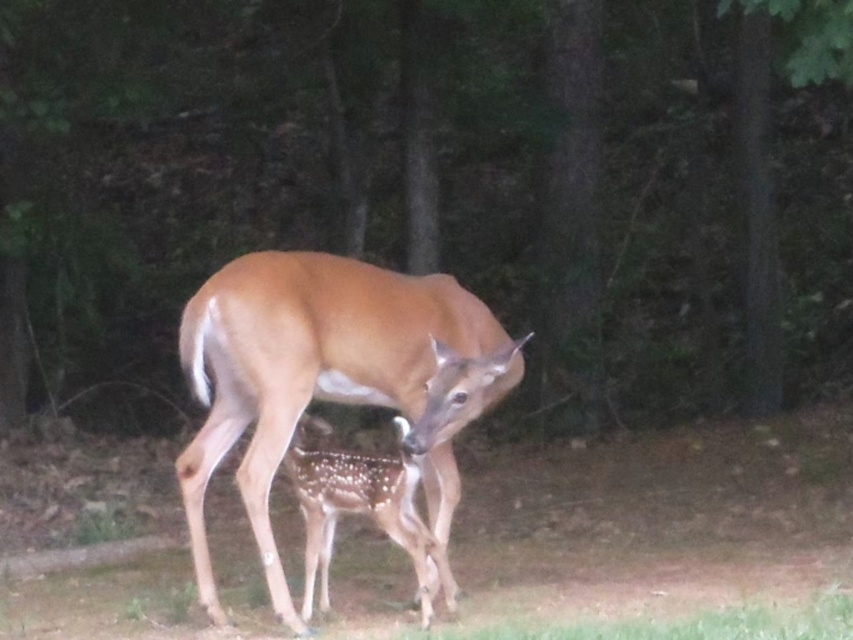
From the picture: Does brown velvet deer at center have a greater height compared to spotted fur fawn at center?

Correct, brown velvet deer at center is much taller as spotted fur fawn at center.

Does brown velvet deer at center appear on the right side of spotted fur fawn at center?

Correct, you'll find brown velvet deer at center to the right of spotted fur fawn at center.

This screenshot has width=853, height=640. In order to click on brown velvet deer at center in this screenshot , I will do pyautogui.click(x=329, y=378).

Find the location of a particular element. This screenshot has width=853, height=640. brown velvet deer at center is located at coordinates (329, 378).